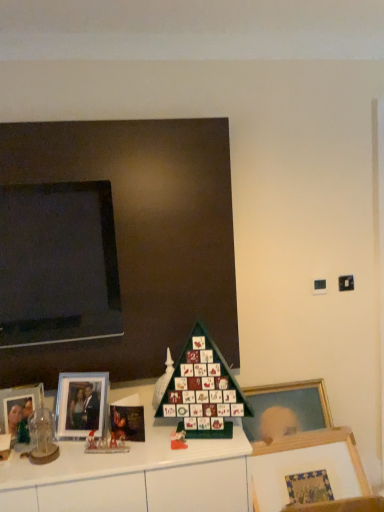
Locate an element on the screen. This screenshot has height=512, width=384. vacant area that is in front of matte plastic advent calendar at center, the second toy viewed from the back is located at coordinates (175, 455).